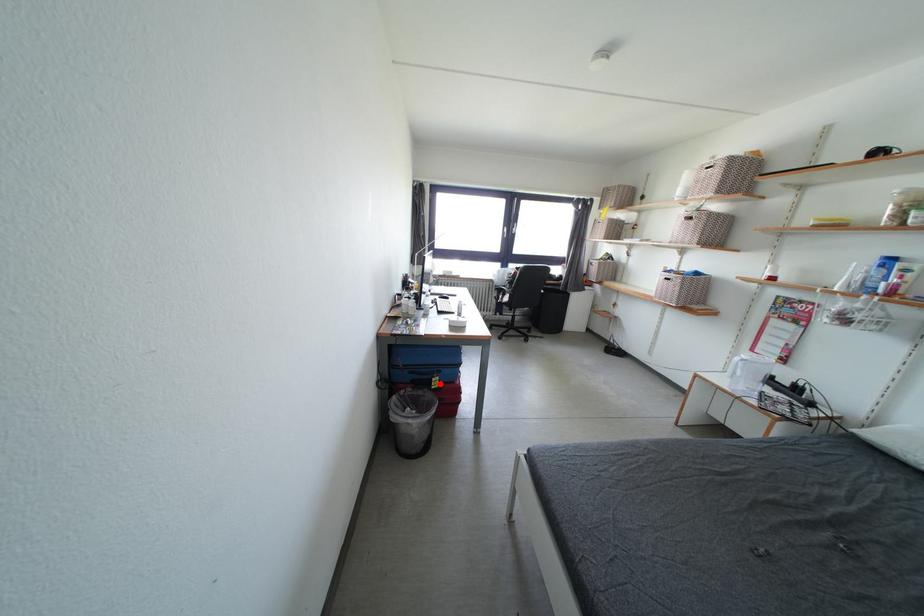
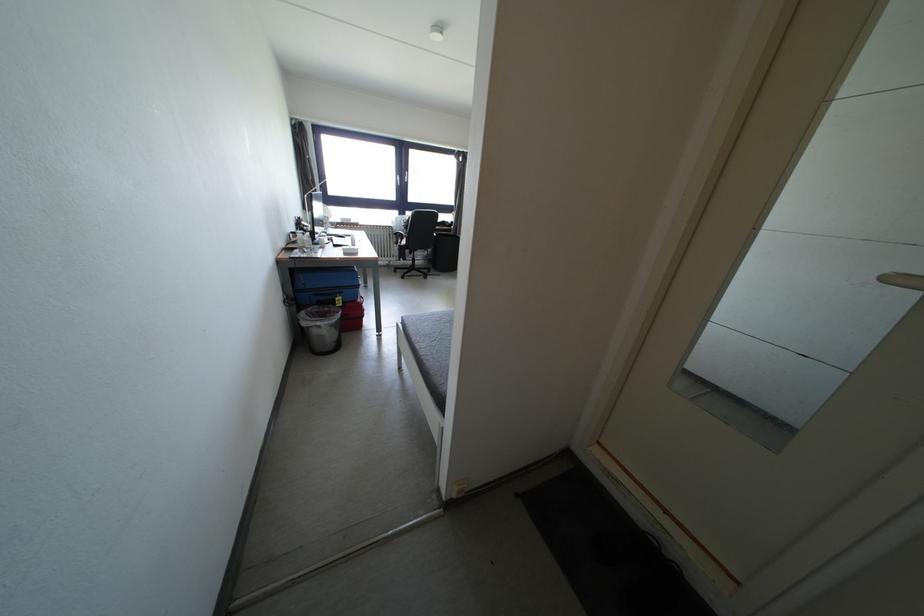
Locate, in the second image, the point that corresponds to the highlighted location in the first image.

(344, 302)